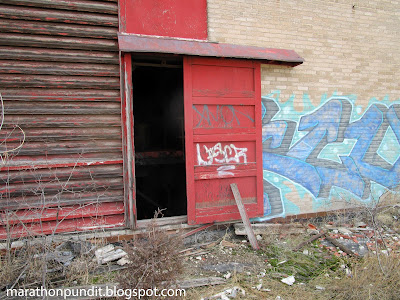
Find the location of a particular element. The height and width of the screenshot is (300, 400). board is located at coordinates (250, 236), (243, 214), (237, 195), (263, 230), (281, 228), (294, 228).